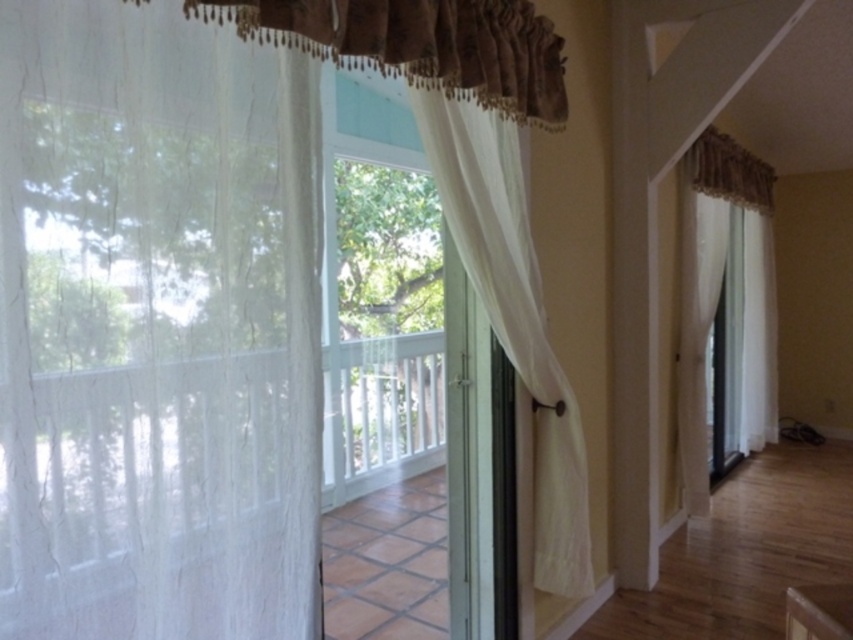
Question: Can you confirm if white sheer curtain at left is positioned below white sheer curtain at right?

Choices:
 (A) yes
 (B) no

Answer: (A)

Question: Which object is positioned farthest from the white sheer curtain at center?

Choices:
 (A) white sheer curtain at left
 (B) white sheer curtain at right

Answer: (B)

Question: Is white sheer curtain at center bigger than white sheer curtain at right?

Choices:
 (A) yes
 (B) no

Answer: (B)

Question: Observing the image, what is the correct spatial positioning of white sheer curtain at left in reference to white sheer curtain at center?

Choices:
 (A) right
 (B) left

Answer: (B)

Question: Which is nearer to the white sheer curtain at center?

Choices:
 (A) white sheer curtain at left
 (B) white sheer curtain at right

Answer: (A)

Question: Which point is farther to the camera?

Choices:
 (A) white sheer curtain at right
 (B) white sheer curtain at left

Answer: (A)